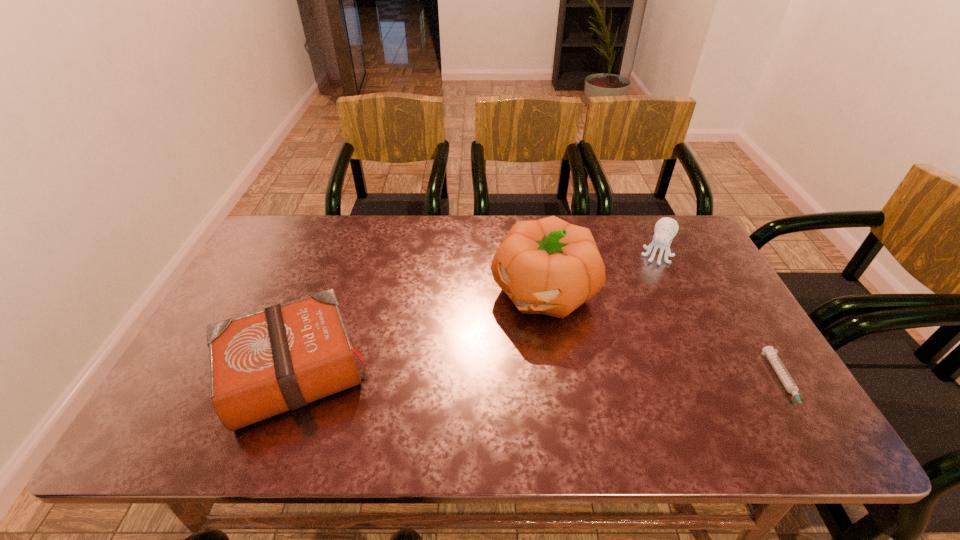
At what (x,y) coordinates should I click in order to perform the action: click on vacant space situated 0.220m on the carved face of the pumpkin. Please return your answer as a coordinate pair (x, y). This screenshot has height=540, width=960. Looking at the image, I should click on (464, 379).

At what (x,y) coordinates should I click in order to perform the action: click on free space located on the carved face of the pumpkin. Please return your answer as a coordinate pair (x, y). The image size is (960, 540). Looking at the image, I should click on (451, 393).

Locate an element on the screen. The width and height of the screenshot is (960, 540). free space located 0.090m on the carved face of the pumpkin is located at coordinates (495, 344).

Identify the location of octopus present at the far edge. This screenshot has height=540, width=960. (666, 228).

Where is `pumpkin that is at the far edge`? pumpkin that is at the far edge is located at coordinates (548, 266).

The height and width of the screenshot is (540, 960). I want to click on Bible present at the near edge, so click(x=262, y=364).

Where is `syringe present at the near edge`? The image size is (960, 540). syringe present at the near edge is located at coordinates (789, 384).

Locate an element on the screen. This screenshot has height=540, width=960. object at the left edge is located at coordinates (262, 364).

Locate an element on the screen. This screenshot has width=960, height=540. syringe that is positioned at the right edge is located at coordinates (789, 384).

I want to click on octopus present at the right edge, so click(666, 228).